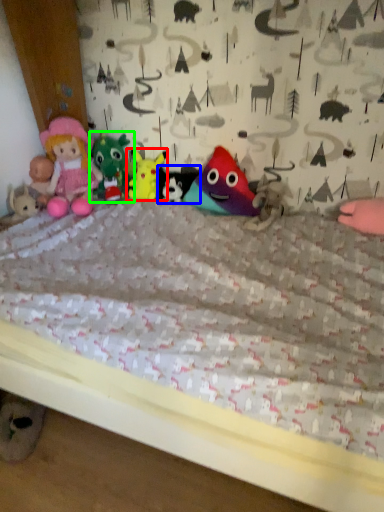
Question: Estimate the real-world distances between objects in this image. Which object is closer to toy (highlighted by a red box), toy (highlighted by a blue box) or toy (highlighted by a green box)?

Choices:
 (A) toy
 (B) toy

Answer: (A)